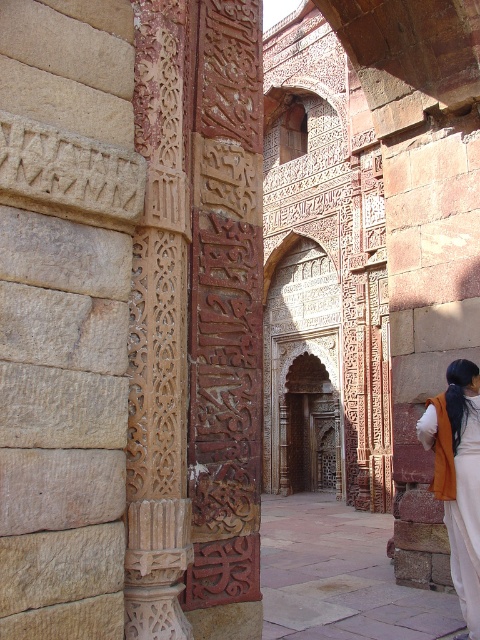
Which is below, pink stone courtyard at center or orange cotton robe at right?

pink stone courtyard at center is below.

Is pink stone courtyard at center to the left of orange cotton robe at right from the viewer's perspective?

Yes, pink stone courtyard at center is to the left of orange cotton robe at right.

Who is more distant from viewer, [442,620] or [465,588]?

The point [442,620] is more distant.

Locate an element on the screen. This screenshot has height=640, width=480. pink stone courtyard at center is located at coordinates (339, 577).

This screenshot has width=480, height=640. What do you see at coordinates (226, 321) in the screenshot? I see `carved stone inscription at center` at bounding box center [226, 321].

Who is positioned more to the right, carved stone inscription at center or pink stone courtyard at center?

pink stone courtyard at center

Is point (259, 513) closer to viewer compared to point (307, 540)?

Yes.

Where is `carved stone inscription at center`? The width and height of the screenshot is (480, 640). carved stone inscription at center is located at coordinates (226, 321).

Who is more forward, (201, 17) or (475, 397)?

Point (201, 17) is more forward.

Can you confirm if carved stone inscription at center is positioned to the right of orange cotton robe at right?

In fact, carved stone inscription at center is to the left of orange cotton robe at right.

The height and width of the screenshot is (640, 480). In order to click on carved stone inscription at center in this screenshot , I will do `click(226, 321)`.